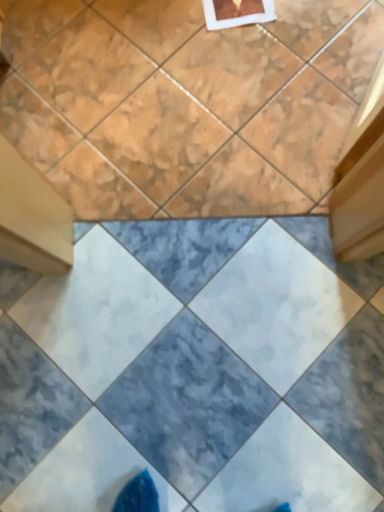
Question: Is marble-like ceramic tile at center, which is counted as the second ceramic tile, starting from the top, positioned with its back to marble tile at upper center, arranged as the 2th ceramic tile when ordered from the bottom?

Choices:
 (A) no
 (B) yes

Answer: (A)

Question: Can you confirm if marble-like ceramic tile at center, which is counted as the second ceramic tile, starting from the top, is positioned to the left of marble tile at upper center, marked as the 1th ceramic tile in a top-to-bottom arrangement?

Choices:
 (A) yes
 (B) no

Answer: (B)

Question: From the image's perspective, would you say marble-like ceramic tile at center, which is counted as the second ceramic tile, starting from the top, is shown under marble tile at upper center, marked as the 1th ceramic tile in a top-to-bottom arrangement?

Choices:
 (A) yes
 (B) no

Answer: (A)

Question: Does marble-like ceramic tile at center, which is counted as the second ceramic tile, starting from the top, have a greater width compared to marble tile at upper center, arranged as the 2th ceramic tile when ordered from the bottom?

Choices:
 (A) yes
 (B) no

Answer: (B)

Question: Can you confirm if marble-like ceramic tile at center, which is counted as the second ceramic tile, starting from the top, is smaller than marble tile at upper center, marked as the 1th ceramic tile in a top-to-bottom arrangement?

Choices:
 (A) no
 (B) yes

Answer: (B)

Question: From a real-world perspective, is marble-like ceramic tile at center, which is counted as the second ceramic tile, starting from the top, over marble tile at upper center, marked as the 1th ceramic tile in a top-to-bottom arrangement?

Choices:
 (A) no
 (B) yes

Answer: (A)

Question: Is marble tile at upper center, arranged as the 2th ceramic tile when ordered from the bottom, surrounding marble-like ceramic tile at center, which is counted as the second ceramic tile, starting from the top?

Choices:
 (A) no
 (B) yes

Answer: (A)

Question: From a real-world perspective, is marble tile at upper center, marked as the 1th ceramic tile in a top-to-bottom arrangement, on marble-like ceramic tile at center, which ranks as the 1th ceramic tile in bottom-to-top order?

Choices:
 (A) yes
 (B) no

Answer: (A)

Question: Could you tell me if marble tile at upper center, arranged as the 2th ceramic tile when ordered from the bottom, is turned towards marble-like ceramic tile at center, which is counted as the second ceramic tile, starting from the top?

Choices:
 (A) no
 (B) yes

Answer: (B)

Question: Considering the relative sizes of marble tile at upper center, arranged as the 2th ceramic tile when ordered from the bottom, and marble-like ceramic tile at center, which is counted as the second ceramic tile, starting from the top, in the image provided, is marble tile at upper center, arranged as the 2th ceramic tile when ordered from the bottom, wider than marble-like ceramic tile at center, which is counted as the second ceramic tile, starting from the top,?

Choices:
 (A) yes
 (B) no

Answer: (A)

Question: Considering the relative sizes of marble tile at upper center, marked as the 1th ceramic tile in a top-to-bottom arrangement, and marble-like ceramic tile at center, which ranks as the 1th ceramic tile in bottom-to-top order, in the image provided, is marble tile at upper center, marked as the 1th ceramic tile in a top-to-bottom arrangement, shorter than marble-like ceramic tile at center, which ranks as the 1th ceramic tile in bottom-to-top order,?

Choices:
 (A) no
 (B) yes

Answer: (B)

Question: Considering the relative positions of marble tile at upper center, marked as the 1th ceramic tile in a top-to-bottom arrangement, and marble-like ceramic tile at center, which ranks as the 1th ceramic tile in bottom-to-top order, in the image provided, is marble tile at upper center, marked as the 1th ceramic tile in a top-to-bottom arrangement, to the right of marble-like ceramic tile at center, which ranks as the 1th ceramic tile in bottom-to-top order, from the viewer's perspective?

Choices:
 (A) yes
 (B) no

Answer: (B)

Question: From the image's perspective, is marble tile at upper center, arranged as the 2th ceramic tile when ordered from the bottom, positioned above or below marble-like ceramic tile at center, which is counted as the second ceramic tile, starting from the top?

Choices:
 (A) below
 (B) above

Answer: (B)